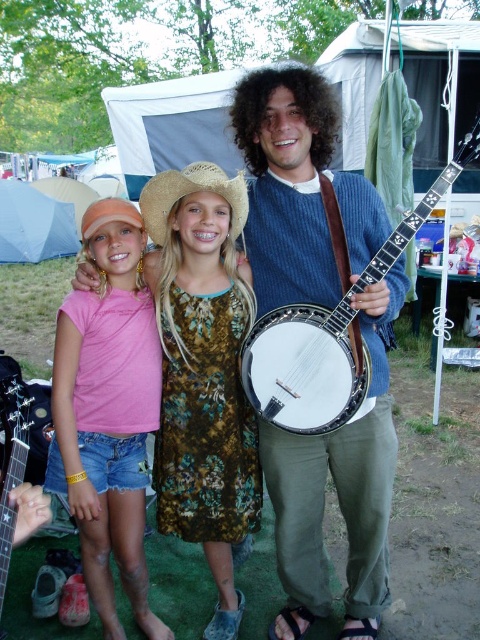
You are standing at the central figure and want to move towards the point at the bottom right of the image. Which of the two points, point [239,83] or point [232,262], is closer to your current position?

Point [232,262] is closer to the central figure because it is in front of point [239,83].

You are standing at the campsite and want to locate the pink fabric dress at center. According to the coordinates provided, in which direction should you look relative to the tents in the background?

The pink fabric dress at center is located at coordinates point (204, 372), so you should look towards the central area between the tents in the background to find it.